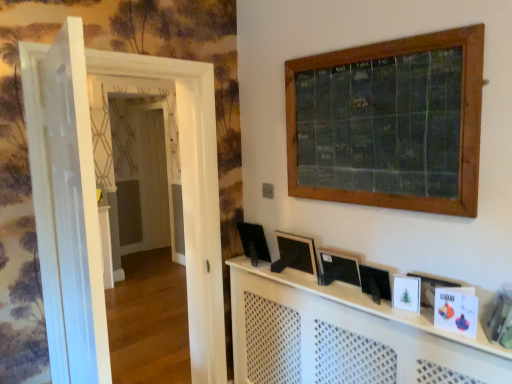
Locate an element on the screen. vacant area in front of black matte picture frame at center, which is the second picture frame from right to left is located at coordinates (393, 311).